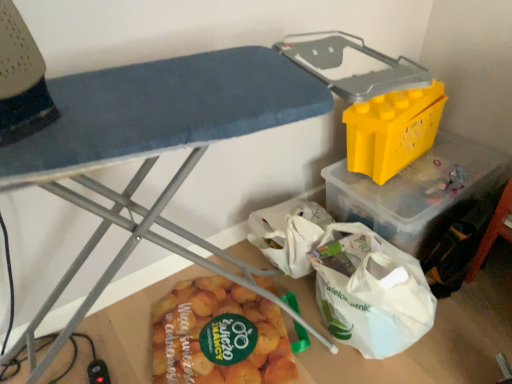
Describe the element at coordinates (392, 130) in the screenshot. The image size is (512, 384). I see `yellow plastic container at upper right` at that location.

Where is `yellow matte potato at lower center`? This screenshot has width=512, height=384. yellow matte potato at lower center is located at coordinates (204, 326).

Where is `yellow plastic storage bin at upper right`? This screenshot has height=384, width=512. yellow plastic storage bin at upper right is located at coordinates (151, 146).

Could you measure the distance between yellow plastic storage bin at upper right and yellow matte potato at lower center?

yellow plastic storage bin at upper right is 43.12 centimeters away from yellow matte potato at lower center.

Is the surface of yellow plastic storage bin at upper right in direct contact with yellow matte potato at lower center?

No, yellow plastic storage bin at upper right is not with yellow matte potato at lower center.

Which object is thinner, yellow plastic storage bin at upper right or yellow matte potato at lower center?

yellow matte potato at lower center is thinner.

Image resolution: width=512 pixels, height=384 pixels. In order to click on furniture above the yellow matte potato at lower center (from the image's perspective) in this screenshot , I will do `click(151, 146)`.

At what (x,y) coordinates should I click in order to perform the action: click on box on the right of yellow plastic storage bin at upper right. Please return your answer as a coordinate pair (x, y). The height and width of the screenshot is (384, 512). Looking at the image, I should click on (392, 130).

In the image, is yellow plastic container at upper right on the left side or the right side of yellow plastic storage bin at upper right?

yellow plastic container at upper right is positioned on yellow plastic storage bin at upper right's right side.

Which is behind, yellow plastic container at upper right or yellow plastic storage bin at upper right?

yellow plastic container at upper right is further away from the camera.

Is yellow plastic container at upper right in contact with yellow plastic storage bin at upper right?

There is a gap between yellow plastic container at upper right and yellow plastic storage bin at upper right.

Considering the positions of objects yellow matte potato at lower center and yellow plastic container at upper right in the image provided, who is behind, yellow matte potato at lower center or yellow plastic container at upper right?

yellow plastic container at upper right is further from the camera.

From a real-world perspective, who is located higher, yellow matte potato at lower center or yellow plastic container at upper right?

From a 3D spatial view, yellow plastic container at upper right is above.

From the image's perspective, is yellow matte potato at lower center positioned above or below yellow plastic container at upper right?

yellow matte potato at lower center is situated lower than yellow plastic container at upper right in the image.

Would you say yellow matte potato at lower center is a long distance from yellow plastic container at upper right?

No, there isn't a large distance between yellow matte potato at lower center and yellow plastic container at upper right.

Is point (73, 164) more distant than point (349, 147)?

No, it is not.

Between yellow plastic storage bin at upper right and yellow plastic container at upper right, which one appears on the left side from the viewer's perspective?

From the viewer's perspective, yellow plastic storage bin at upper right appears more on the left side.

Where is `box on the right of the yellow matte potato at lower center`? Image resolution: width=512 pixels, height=384 pixels. box on the right of the yellow matte potato at lower center is located at coordinates (x=392, y=130).

Considering the sizes of yellow plastic container at upper right and yellow matte potato at lower center in the image, is yellow plastic container at upper right wider or thinner than yellow matte potato at lower center?

Clearly, yellow plastic container at upper right has less width compared to yellow matte potato at lower center.

Considering the relative positions of yellow plastic container at upper right and yellow matte potato at lower center in the image provided, is yellow plastic container at upper right behind yellow matte potato at lower center?

Yes, it is behind yellow matte potato at lower center.

From the picture: From a real-world perspective, who is located higher, yellow matte potato at lower center or yellow plastic storage bin at upper right?

yellow plastic storage bin at upper right is physically above.

Is yellow matte potato at lower center oriented towards yellow plastic storage bin at upper right?

Yes.

Between yellow matte potato at lower center and yellow plastic storage bin at upper right, which one appears on the right side from the viewer's perspective?

yellow matte potato at lower center is more to the right.

Looking at their sizes, would you say yellow matte potato at lower center is wider or thinner than yellow plastic storage bin at upper right?

yellow matte potato at lower center is thinner than yellow plastic storage bin at upper right.

Where is `furniture in front of the yellow matte potato at lower center`? furniture in front of the yellow matte potato at lower center is located at coordinates (151, 146).

Where is `box below the yellow plastic storage bin at upper right (from a real-world perspective)`? Image resolution: width=512 pixels, height=384 pixels. box below the yellow plastic storage bin at upper right (from a real-world perspective) is located at coordinates (392, 130).

Estimate the real-world distances between objects in this image. Which object is further from yellow matte potato at lower center, yellow plastic container at upper right or yellow plastic storage bin at upper right?

yellow plastic container at upper right is positioned further to the anchor yellow matte potato at lower center.

From the image, which object appears to be nearer to yellow plastic container at upper right, yellow matte potato at lower center or yellow plastic storage bin at upper right?

yellow matte potato at lower center is positioned closer to the anchor yellow plastic container at upper right.

From the image, which object appears to be nearer to yellow plastic container at upper right, yellow plastic storage bin at upper right or yellow matte potato at lower center?

yellow matte potato at lower center is closer to yellow plastic container at upper right.

Considering their positions, is yellow plastic storage bin at upper right positioned closer to yellow matte potato at lower center than yellow plastic container at upper right?

The object closer to yellow matte potato at lower center is yellow plastic storage bin at upper right.

Estimate the real-world distances between objects in this image. Which object is further from yellow plastic storage bin at upper right, yellow matte potato at lower center or yellow plastic container at upper right?

Among the two, yellow plastic container at upper right is located further to yellow plastic storage bin at upper right.

Which object lies nearer to the anchor point yellow plastic storage bin at upper right, yellow plastic container at upper right or yellow matte potato at lower center?

yellow matte potato at lower center.

Identify the location of food between yellow plastic storage bin at upper right and yellow plastic container at upper right from front to back. (204, 326).